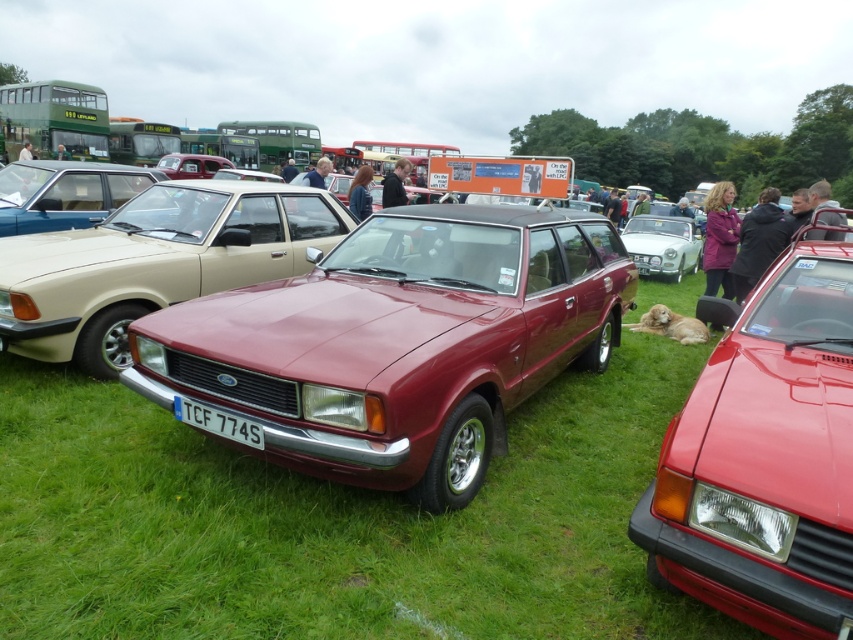
In the scene shown: Between shiny red car at center and satin burgundy station wagon at center, which one is positioned lower?

shiny red car at center

Find the location of `shiny red car at center`. shiny red car at center is located at coordinates (764, 454).

Is point (833, 580) closer to camera compared to point (215, 196)?

That is True.

Locate an element on the screen. shiny red car at center is located at coordinates (764, 454).

Is point (474, 209) farther from camera compared to point (699, 483)?

Yes, it is behind point (699, 483).

Based on the photo, does maroon metallic station wagon at center appear on the left side of shiny red car at center?

Correct, you'll find maroon metallic station wagon at center to the left of shiny red car at center.

Is point (260, 346) in front of point (822, 592)?

No, it is not.

You are a GUI agent. You are given a task and a screenshot of the screen. Output one action in this format:
    pyautogui.click(x=<x>, y=<y>)
    Task: Click on the maroon metallic station wagon at center
    Image resolution: width=853 pixels, height=640 pixels.
    Given the screenshot: What is the action you would take?
    pyautogui.click(x=399, y=342)

Which is more to the right, satin burgundy station wagon at center or satin beige station wagon at left?

satin burgundy station wagon at center

Is satin burgundy station wagon at center further to the viewer compared to satin beige station wagon at left?

No, it is in front of satin beige station wagon at left.

Is point (9, 289) positioned after point (55, 170)?

No, it is not.

Where is `satin burgundy station wagon at center`? satin burgundy station wagon at center is located at coordinates coord(154,262).